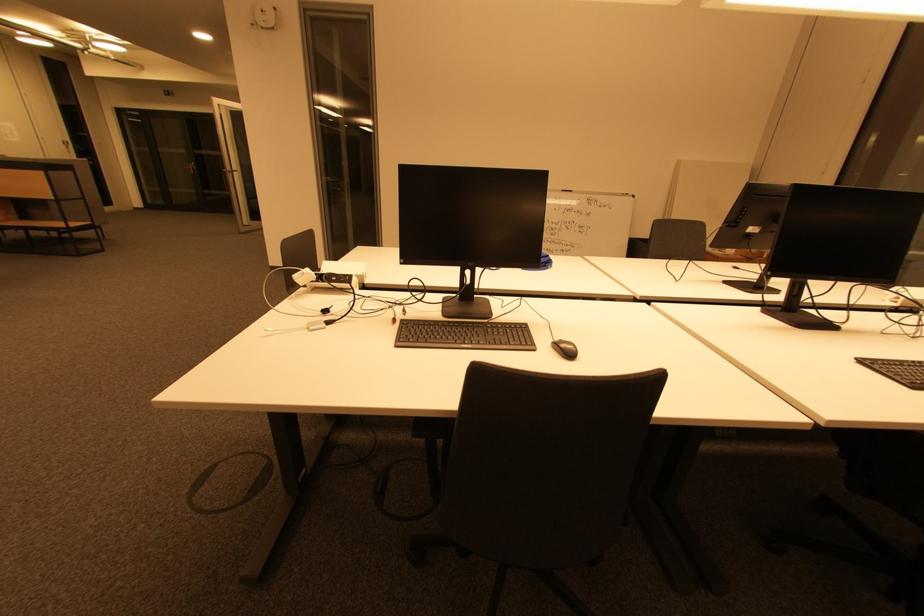
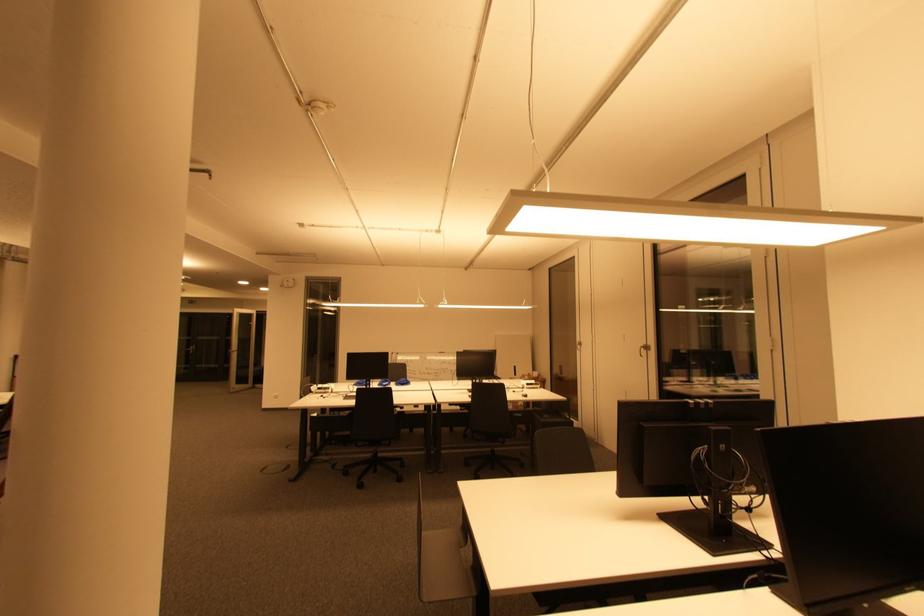
Question: In a continuous first-person perspective shot, in which direction is the camera moving?

Choices:
 (A) Left
 (B) Right
 (C) Forward
 (D) Backward

Answer: (D)